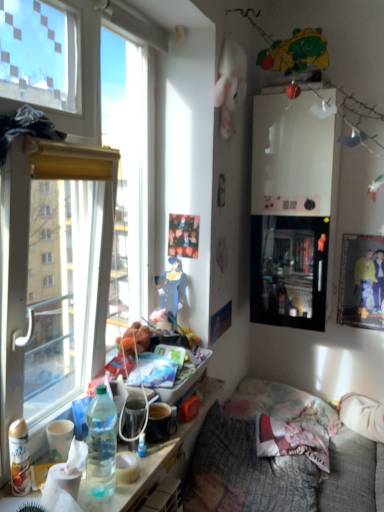
Question: From the image's perspective, is plush green bear at upper right under translucent plastic water bottle at lower left?

Choices:
 (A) yes
 (B) no

Answer: (B)

Question: From a real-world perspective, is plush green bear at upper right positioned over translucent plastic water bottle at lower left based on gravity?

Choices:
 (A) yes
 (B) no

Answer: (A)

Question: Are plush green bear at upper right and translucent plastic water bottle at lower left far apart?

Choices:
 (A) no
 (B) yes

Answer: (B)

Question: Can you confirm if plush green bear at upper right is taller than translucent plastic water bottle at lower left?

Choices:
 (A) no
 (B) yes

Answer: (B)

Question: Is plush green bear at upper right facing away from translucent plastic water bottle at lower left?

Choices:
 (A) yes
 (B) no

Answer: (B)

Question: From the image's perspective, relative to metallic glossy picture frame at upper right, is plush green bear at upper right above or below?

Choices:
 (A) above
 (B) below

Answer: (A)

Question: Do you think plush green bear at upper right is within metallic glossy picture frame at upper right, or outside of it?

Choices:
 (A) inside
 (B) outside

Answer: (B)

Question: Considering the positions of plush green bear at upper right and metallic glossy picture frame at upper right in the image, is plush green bear at upper right taller or shorter than metallic glossy picture frame at upper right?

Choices:
 (A) short
 (B) tall

Answer: (A)

Question: In the image, is plush green bear at upper right positioned in front of or behind metallic glossy picture frame at upper right?

Choices:
 (A) behind
 (B) front

Answer: (B)

Question: From the image's perspective, is blue denim dress at center positioned above or below textured gray fabric couch at lower right?

Choices:
 (A) above
 (B) below

Answer: (A)

Question: Considering the positions of point (158, 296) and point (306, 496), is point (158, 296) closer or farther from the camera than point (306, 496)?

Choices:
 (A) farther
 (B) closer

Answer: (A)

Question: Considering the positions of blue denim dress at center and textured gray fabric couch at lower right in the image, is blue denim dress at center taller or shorter than textured gray fabric couch at lower right?

Choices:
 (A) short
 (B) tall

Answer: (A)

Question: In terms of size, does blue denim dress at center appear bigger or smaller than textured gray fabric couch at lower right?

Choices:
 (A) small
 (B) big

Answer: (A)

Question: Considering the positions of textured gray fabric couch at lower right and blue denim dress at center in the image, is textured gray fabric couch at lower right bigger or smaller than blue denim dress at center?

Choices:
 (A) big
 (B) small

Answer: (A)

Question: Do you think textured gray fabric couch at lower right is within blue denim dress at center, or outside of it?

Choices:
 (A) outside
 (B) inside

Answer: (A)